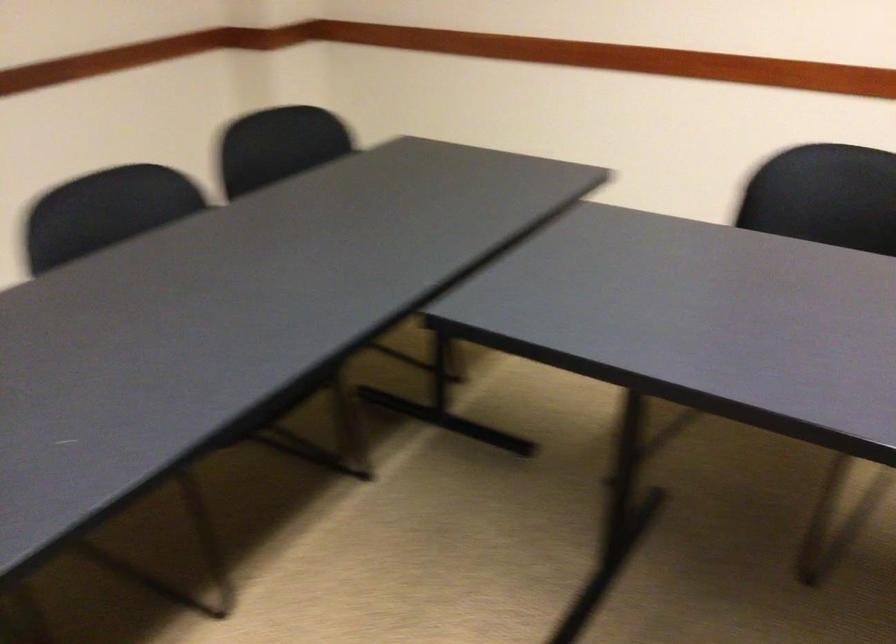
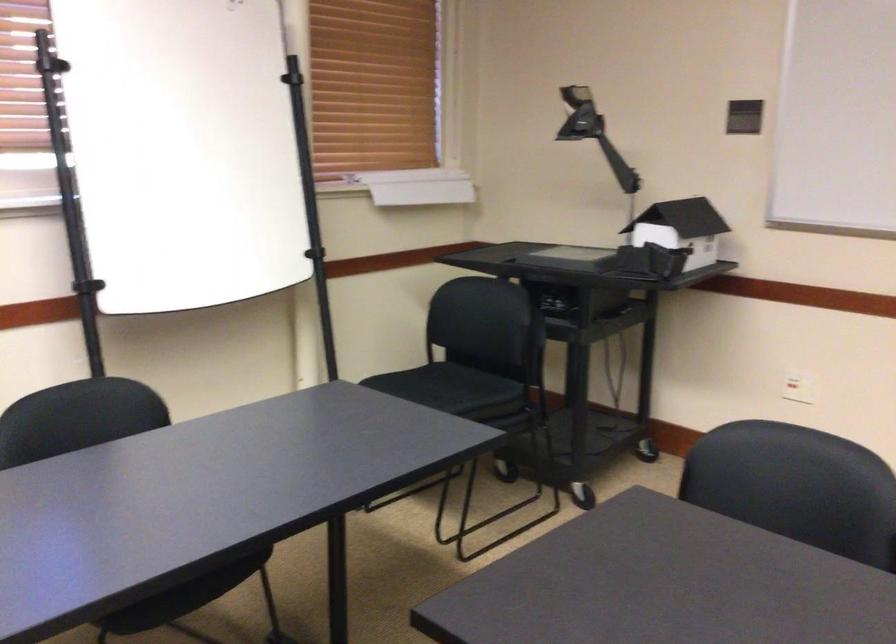
Question: How did the camera likely rotate?

Choices:
 (A) Left
 (B) Right
 (C) Up
 (D) Down

Answer: (B)